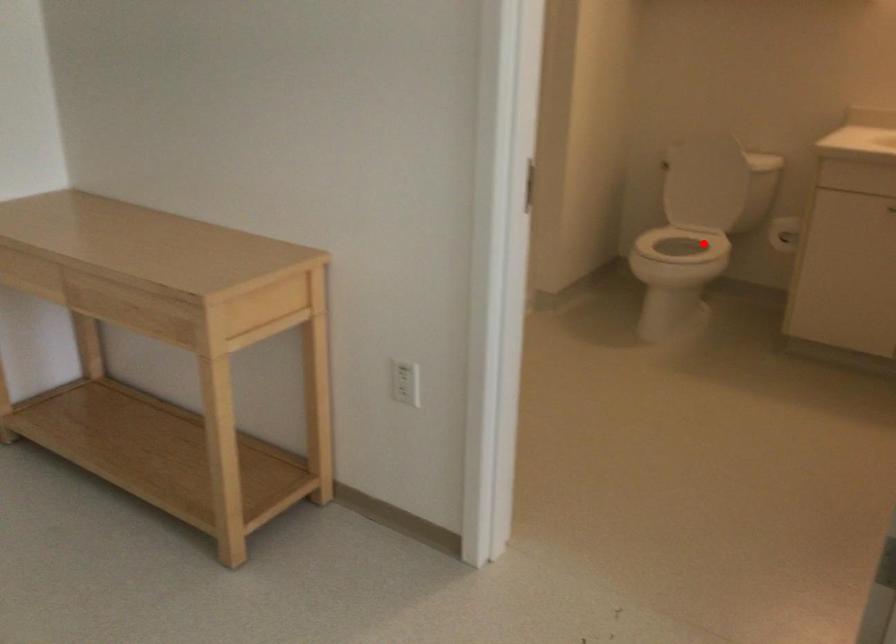
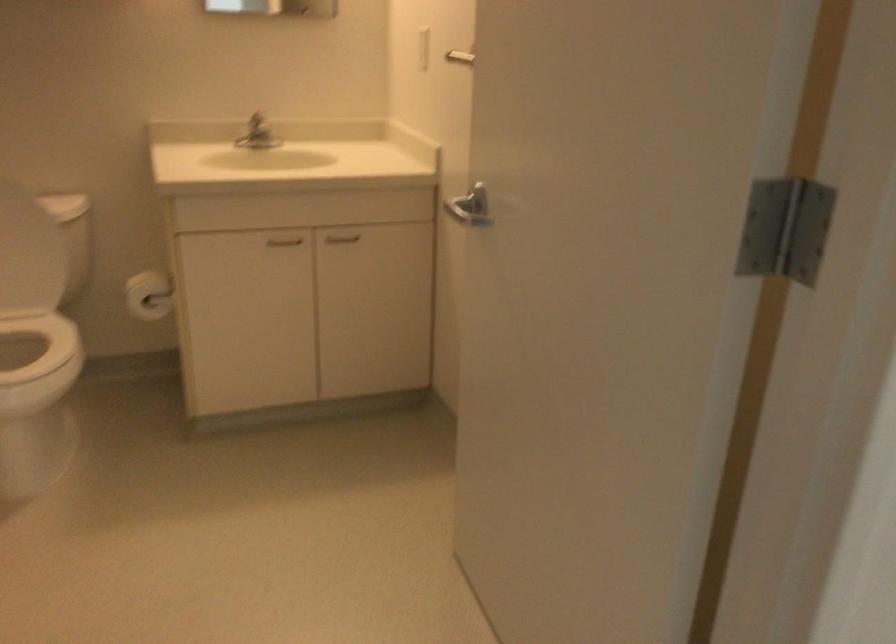
Question: I am providing you with two images of the same scene from different viewpoints. Given a red point in image1, look at the same physical point in image2. Is it:

Choices:
 (A) Closer to the viewpoint
 (B) Farther from the viewpoint

Answer: (A)